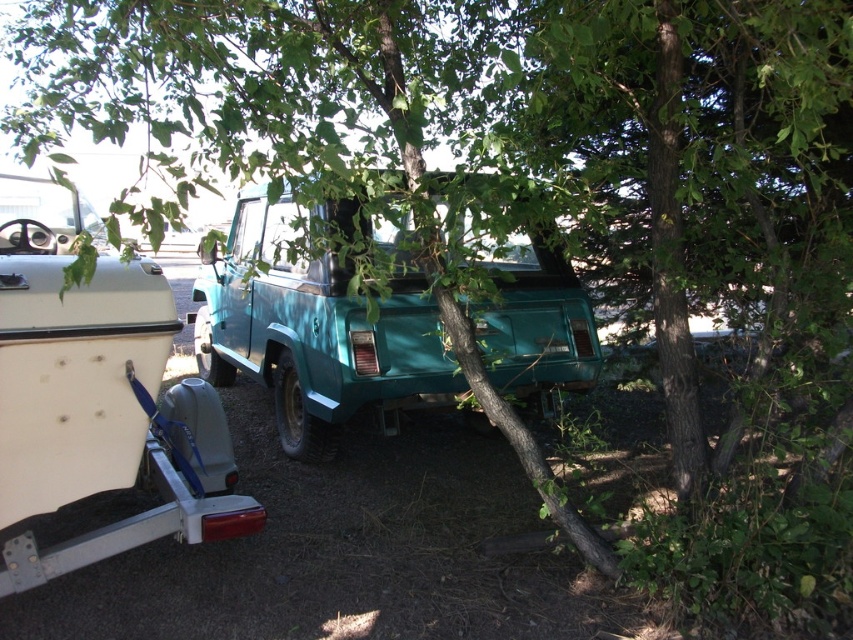
You are standing at the center of the image and want to move towards the teal matte pickup truck at left. Which direction should you go?

Since the teal matte pickup truck at left is located at point 0.620 on the x axis and 0.113 on the y axis, you should move to the left and slightly downward to reach it.